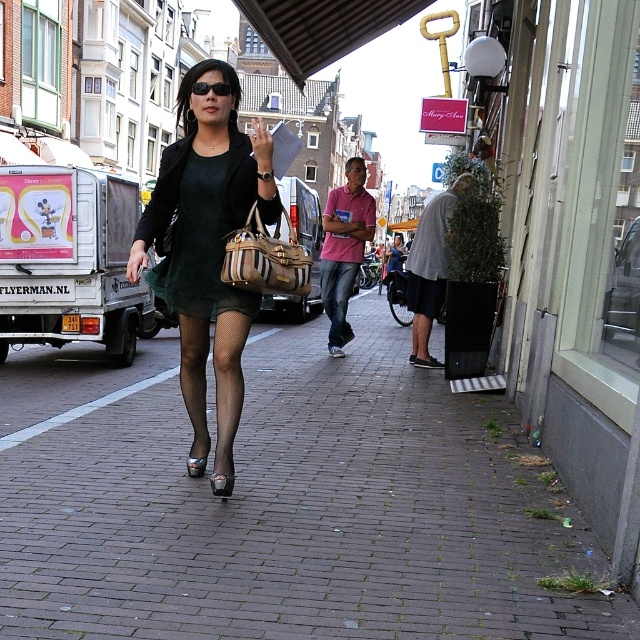
Question: Which point is closer to the camera taking this photo?

Choices:
 (A) (189, 252)
 (B) (84, 604)
 (C) (355, 243)
 (D) (260, 273)

Answer: (B)

Question: Which object is positioned closest to the leather textured handbag at center?

Choices:
 (A) brick pavement at center
 (B) gray fabric short at right

Answer: (A)

Question: Does pink cotton shirt at center appear under shiny silver sandal at center?

Choices:
 (A) no
 (B) yes

Answer: (A)

Question: Is green matte dress at center wider than shiny metallic sandal at center?

Choices:
 (A) yes
 (B) no

Answer: (A)

Question: Can you confirm if shiny silver sandal at center is positioned to the left of black plastic sunglasses at center?

Choices:
 (A) yes
 (B) no

Answer: (B)

Question: Which of the following is the farthest from the observer?

Choices:
 (A) shiny silver sandal at center
 (B) pink cotton shirt at center

Answer: (B)